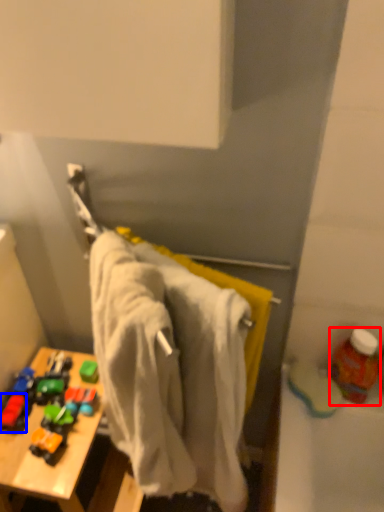
Question: Which object is further to the camera taking this photo, bottle (highlighted by a red box) or toy (highlighted by a blue box)?

Choices:
 (A) bottle
 (B) toy

Answer: (B)